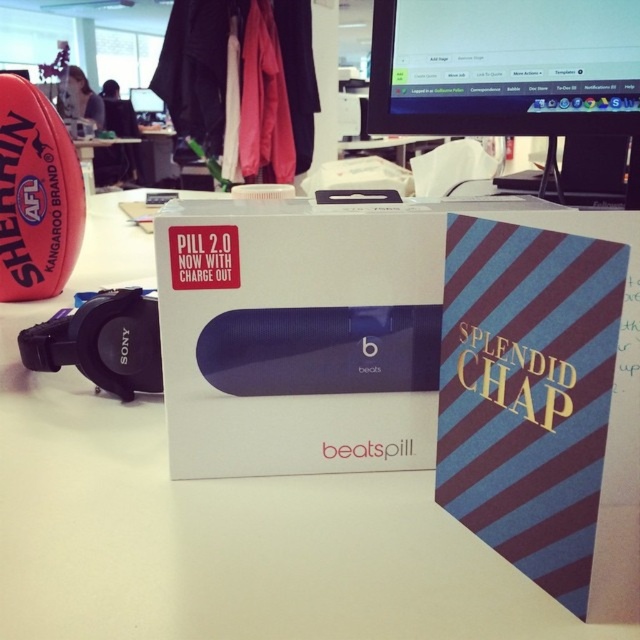
Does black glossy monitor at upper center appear on the left side of black glossy computer monitor at upper center?

Incorrect, black glossy monitor at upper center is not on the left side of black glossy computer monitor at upper center.

Can you confirm if black glossy monitor at upper center is bigger than black glossy computer monitor at upper center?

Yes, black glossy monitor at upper center is bigger than black glossy computer monitor at upper center.

In order to click on black glossy monitor at upper center in this screenshot , I will do `click(508, 68)`.

The width and height of the screenshot is (640, 640). Find the location of `black glossy monitor at upper center`. black glossy monitor at upper center is located at coordinates (508, 68).

Which of these two, black glossy monitor at upper center or white glossy table at center, stands shorter?

With less height is black glossy monitor at upper center.

Between black glossy monitor at upper center and white glossy table at center, which one appears on the right side from the viewer's perspective?

black glossy monitor at upper center is more to the right.

I want to click on black glossy monitor at upper center, so click(508, 68).

Describe the element at coordinates (216, 534) in the screenshot. The image size is (640, 640). I see `white matte table at center` at that location.

Find the location of a particular element. The height and width of the screenshot is (640, 640). white matte table at center is located at coordinates (216, 534).